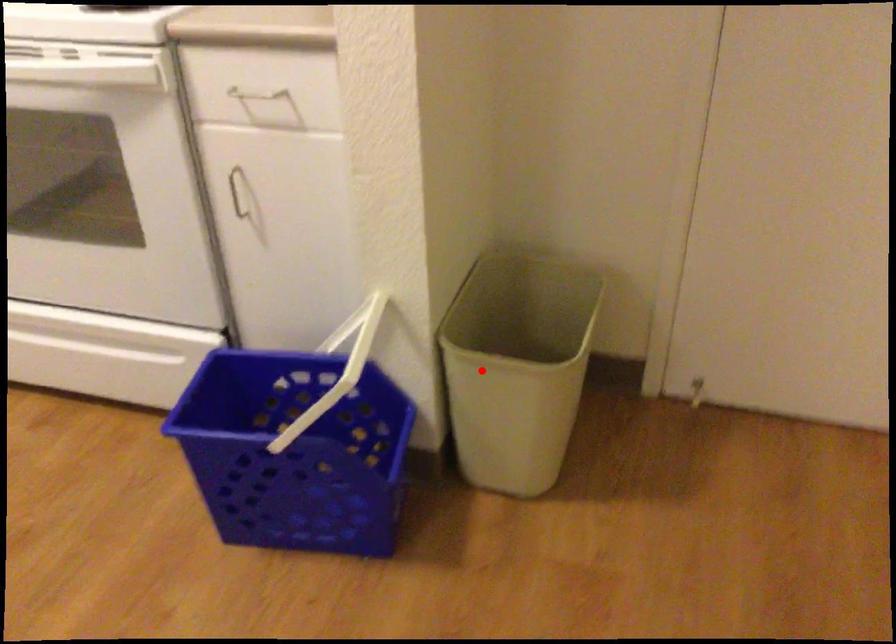
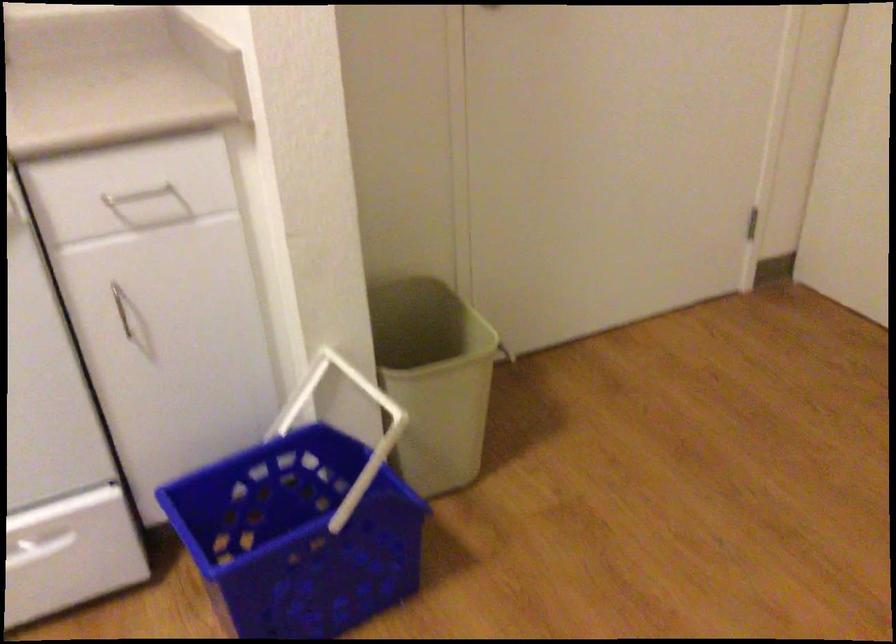
Locate, in the second image, the point that corresponds to the highlighted location in the first image.

(434, 379)